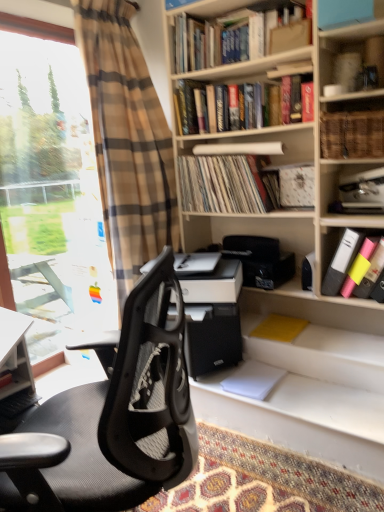
Question: Can you confirm if patterned carpet at lower center is taller than black mesh office chair at left?

Choices:
 (A) yes
 (B) no

Answer: (B)

Question: From the image's perspective, is patterned carpet at lower center located beneath black mesh office chair at left?

Choices:
 (A) no
 (B) yes

Answer: (B)

Question: Does patterned carpet at lower center lie behind black mesh office chair at left?

Choices:
 (A) no
 (B) yes

Answer: (B)

Question: Can you confirm if patterned carpet at lower center is thinner than black mesh office chair at left?

Choices:
 (A) no
 (B) yes

Answer: (B)

Question: Is patterned carpet at lower center wider than black mesh office chair at left?

Choices:
 (A) no
 (B) yes

Answer: (A)

Question: From the image's perspective, relative to black mesh office chair at left, is hardcover book at upper center, the fifth book in the bottom-to-top sequence, above or below?

Choices:
 (A) below
 (B) above

Answer: (B)

Question: In terms of height, does hardcover book at upper center, the 2th book in the top-to-bottom sequence, look taller or shorter compared to black mesh office chair at left?

Choices:
 (A) tall
 (B) short

Answer: (B)

Question: Looking at their shapes, would you say hardcover book at upper center, the fifth book in the bottom-to-top sequence, is wider or thinner than black mesh office chair at left?

Choices:
 (A) wide
 (B) thin

Answer: (B)

Question: Is hardcover book at upper center, the 2th book in the top-to-bottom sequence, bigger or smaller than black mesh office chair at left?

Choices:
 (A) small
 (B) big

Answer: (A)

Question: Is hardcover books at upper center, arranged as the 1th book when viewed from the top, bigger or smaller than woven wicker basket at upper right, which appears as the 3th book when viewed from the top?

Choices:
 (A) big
 (B) small

Answer: (A)

Question: Choose the correct answer: Is hardcover books at upper center, arranged as the 1th book when viewed from the top, inside woven wicker basket at upper right, which appears as the 3th book when viewed from the top, or outside it?

Choices:
 (A) outside
 (B) inside

Answer: (A)

Question: Does point (173, 45) appear closer or farther from the camera than point (380, 122)?

Choices:
 (A) closer
 (B) farther

Answer: (B)

Question: Is hardcover books at upper center, placed as the 6th book when sorted from bottom to top, in front of or behind woven wicker basket at upper right, which appears as the 3th book when viewed from the top, in the image?

Choices:
 (A) front
 (B) behind

Answer: (B)

Question: From their relative heights in the image, would you say matte vinyl records at center, marked as the third book in a bottom-to-top arrangement, is taller or shorter than hardcover books at upper center, arranged as the 1th book when viewed from the top?

Choices:
 (A) tall
 (B) short

Answer: (A)

Question: Visually, is matte vinyl records at center, which ranks as the 4th book in top-to-bottom order, positioned to the left or to the right of hardcover books at upper center, arranged as the 1th book when viewed from the top?

Choices:
 (A) left
 (B) right

Answer: (A)